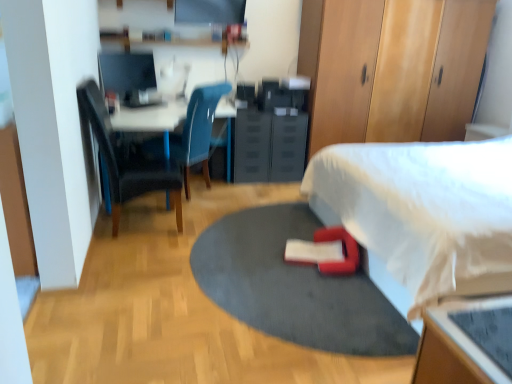
In order to face matte blue chair at center, which ranks as the second chair in front-to-back order, should I rotate leftwards or rightwards?

It's best to rotate left around 9.474 degrees.

You are a GUI agent. You are given a task and a screenshot of the screen. Output one action in this format:
    pyautogui.click(x=<x>, y=<y>)
    Task: Click on the black plastic drawer at center
    
    Given the screenshot: What is the action you would take?
    pyautogui.click(x=252, y=146)

I want to click on white glossy desk at upper left, so click(149, 118).

What is the approximate width of matte black dresser at center, positioned as the first dresser in left-to-right order?

25.28 inches.

Where is `red fabric bean bag chair at lower center`? red fabric bean bag chair at lower center is located at coordinates (326, 251).

Identify the location of matte blue chair at center, which ranks as the second chair in front-to-back order. (197, 131).

From a real-world perspective, which is physically below, dark blue fabric chair at left, marked as the first chair in a front-to-back arrangement, or white fabric bed at lower right?

white fabric bed at lower right.

Does dark blue fabric chair at left, which appears as the second chair when viewed from the back, have a greater height compared to white fabric bed at lower right?

Correct, dark blue fabric chair at left, which appears as the second chair when viewed from the back, is much taller as white fabric bed at lower right.

Which of these two, dark blue fabric chair at left, marked as the first chair in a front-to-back arrangement, or white fabric bed at lower right, is smaller?

Smaller between the two is dark blue fabric chair at left, marked as the first chair in a front-to-back arrangement.

From the picture: How distant is dark blue fabric chair at left, which appears as the second chair when viewed from the back, from white fabric bed at lower right?

The distance of dark blue fabric chair at left, which appears as the second chair when viewed from the back, from white fabric bed at lower right is 1.61 meters.

Considering the relative positions of white fabric bed at lower right and red rubber yoga mat at center in the image provided, is white fabric bed at lower right to the left of red rubber yoga mat at center from the viewer's perspective?

No, white fabric bed at lower right is not to the left of red rubber yoga mat at center.

This screenshot has width=512, height=384. I want to click on bed in front of the red rubber yoga mat at center, so click(419, 212).

Relative to red rubber yoga mat at center, is white fabric bed at lower right in front or behind?

Visually, white fabric bed at lower right is located in front of red rubber yoga mat at center.

Who is bigger, white fabric bed at lower right or red rubber yoga mat at center?

white fabric bed at lower right.

Is dark blue fabric chair at left, marked as the first chair in a front-to-back arrangement, next to matte blue chair at center, positioned as the 1th chair in back-to-front order, and touching it?

No, dark blue fabric chair at left, marked as the first chair in a front-to-back arrangement, is not in contact with matte blue chair at center, positioned as the 1th chair in back-to-front order.

Looking at this image, is dark blue fabric chair at left, marked as the first chair in a front-to-back arrangement, in front of or behind matte blue chair at center, which ranks as the second chair in front-to-back order, in the image?

Clearly, dark blue fabric chair at left, marked as the first chair in a front-to-back arrangement, is in front of matte blue chair at center, which ranks as the second chair in front-to-back order.

Is dark blue fabric chair at left, which appears as the second chair when viewed from the back, located outside matte blue chair at center, positioned as the 1th chair in back-to-front order?

dark blue fabric chair at left, which appears as the second chair when viewed from the back, is positioned outside matte blue chair at center, positioned as the 1th chair in back-to-front order.

Which is behind, point (111, 192) or point (205, 109)?

The point (205, 109) is farther.

Considering the sizes of objects white glossy desk at upper left and red rubber yoga mat at center in the image provided, who is thinner, white glossy desk at upper left or red rubber yoga mat at center?

white glossy desk at upper left.

From the picture: Between white glossy desk at upper left and red rubber yoga mat at center, which one is positioned in front?

red rubber yoga mat at center is closer to the camera.

Does white glossy desk at upper left have a greater height compared to red rubber yoga mat at center?

Yes.

Can you confirm if white glossy desk at upper left is positioned to the right of red rubber yoga mat at center?

No, white glossy desk at upper left is not to the right of red rubber yoga mat at center.

From the picture: Considering the relative sizes of matte black dresser at center, positioned as the first dresser in left-to-right order, and white fabric bed at lower right in the image provided, is matte black dresser at center, positioned as the first dresser in left-to-right order, taller than white fabric bed at lower right?

Incorrect, the height of matte black dresser at center, positioned as the first dresser in left-to-right order, is not larger of that of white fabric bed at lower right.

From a real-world perspective, is matte black dresser at center, positioned as the first dresser in left-to-right order, positioned under white fabric bed at lower right based on gravity?

Correct, in the physical world, matte black dresser at center, positioned as the first dresser in left-to-right order, is lower than white fabric bed at lower right.

Based on their sizes in the image, would you say matte black dresser at center, positioned as the first dresser in left-to-right order, is bigger or smaller than white fabric bed at lower right?

matte black dresser at center, positioned as the first dresser in left-to-right order, is smaller than white fabric bed at lower right.

Looking at this image, can you tell me how much white glossy desk at upper left and red fabric bean bag chair at lower center differ in facing direction?

white glossy desk at upper left and red fabric bean bag chair at lower center are facing 161 degrees away from each other.

From the image's perspective, is white glossy desk at upper left below red fabric bean bag chair at lower center?

No, from the image's perspective, white glossy desk at upper left is not below red fabric bean bag chair at lower center.

Based on the photo, is white glossy desk at upper left not inside red fabric bean bag chair at lower center?

white glossy desk at upper left lies outside red fabric bean bag chair at lower center's area.

Based on the photo, from a real-world perspective, is matte black monitor at upper left under matte black dresser at center, positioned as the first dresser in left-to-right order?

No, from a real-world perspective, matte black monitor at upper left is not below matte black dresser at center, positioned as the first dresser in left-to-right order.

What's the angular difference between matte black monitor at upper left and matte black dresser at center, placed as the 2th dresser when sorted from right to left,'s facing directions?

42.6 degrees.

Where is `computer monitor above the matte black dresser at center, positioned as the first dresser in left-to-right order (from a real-world perspective)`? Image resolution: width=512 pixels, height=384 pixels. computer monitor above the matte black dresser at center, positioned as the first dresser in left-to-right order (from a real-world perspective) is located at coordinates (128, 76).

From the image's perspective, is matte black monitor at upper left over matte black dresser at center, placed as the 2th dresser when sorted from right to left?

Indeed, from the image's perspective, matte black monitor at upper left is shown above matte black dresser at center, placed as the 2th dresser when sorted from right to left.

You are a GUI agent. You are given a task and a screenshot of the screen. Output one action in this format:
    pyautogui.click(x=<x>, y=<y>)
    Task: Click on the bed that appears below the dark blue fabric chair at left, which appears as the second chair when viewed from the back (from a real-world perspective)
    The height and width of the screenshot is (384, 512).
    Given the screenshot: What is the action you would take?
    pyautogui.click(x=419, y=212)

Where is `yoga mat located on the left of white fabric bed at lower right`? yoga mat located on the left of white fabric bed at lower right is located at coordinates (294, 286).

From the image, which object appears to be nearer to red fabric bean bag chair at lower center, matte black dresser at center, placed as the 2th dresser when sorted from right to left, or white glossy desk at upper left?

The object closer to red fabric bean bag chair at lower center is matte black dresser at center, placed as the 2th dresser when sorted from right to left.

Looking at this image, estimate the real-world distances between objects in this image. Which object is further from matte blue chair at center, which ranks as the second chair in front-to-back order, white glossy desk at upper left or matte black monitor at upper left?

The object further to matte blue chair at center, which ranks as the second chair in front-to-back order, is matte black monitor at upper left.

Looking at the image, which one is located further to matte blue chair at center, which ranks as the second chair in front-to-back order, red rubber yoga mat at center or dark blue fabric chair at left, which appears as the second chair when viewed from the back?

red rubber yoga mat at center.

When comparing their distances from black plastic drawer at center, does white fabric bed at lower right or red rubber yoga mat at center seem further?

Based on the image, red rubber yoga mat at center appears to be further to black plastic drawer at center.

Considering their positions, is matte black dresser at center, positioned as the first dresser in left-to-right order, positioned closer to red fabric bean bag chair at lower center than white fabric bed at lower right?

Among the two, white fabric bed at lower right is located nearer to red fabric bean bag chair at lower center.

Looking at the image, which one is located closer to red fabric bean bag chair at lower center, white fabric bed at lower right or black plastic drawer at center?

Based on the image, white fabric bed at lower right appears to be nearer to red fabric bean bag chair at lower center.

Considering their positions, is red fabric bean bag chair at lower center positioned further to matte blue chair at center, positioned as the 1th chair in back-to-front order, than matte black monitor at upper left?

Among the two, red fabric bean bag chair at lower center is located further to matte blue chair at center, positioned as the 1th chair in back-to-front order.

Which object lies nearer to the anchor point black plastic drawer at center, red fabric bean bag chair at lower center or white fabric bed at lower right?

Among the two, white fabric bed at lower right is located nearer to black plastic drawer at center.

Identify the location of bean bag chair located between matte black monitor at upper left and white fabric bed at lower right in the left-right direction. This screenshot has height=384, width=512. (326, 251).

The height and width of the screenshot is (384, 512). Identify the location of dresser situated between matte black monitor at upper left and wooden dresser at upper right, the 2th dresser viewed from the left, from left to right. (269, 146).

The image size is (512, 384). I want to click on bean bag chair between white fabric bed at lower right and black plastic drawer at center in the front-back direction, so click(x=326, y=251).

The height and width of the screenshot is (384, 512). What are the coordinates of `computer monitor between dark blue fabric chair at left, marked as the first chair in a front-to-back arrangement, and black plastic drawer at center, along the z-axis` in the screenshot? It's located at (128, 76).